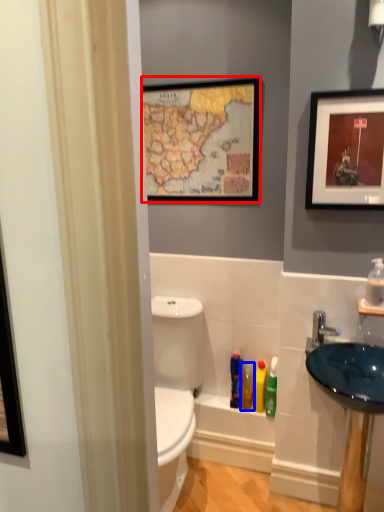
Question: Which object is further to the camera taking this photo, picture frame (highlighted by a red box) or toiletry (highlighted by a blue box)?

Choices:
 (A) picture frame
 (B) toiletry

Answer: (B)